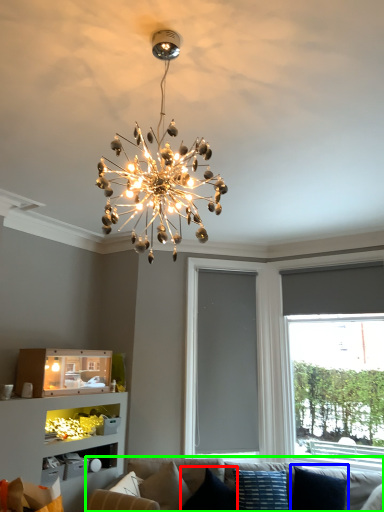
Question: Estimate the real-world distances between objects in this image. Which object is closer to pillow (highlighted by a red box), pillow (highlighted by a blue box) or studio couch (highlighted by a green box)?

Choices:
 (A) pillow
 (B) studio couch

Answer: (B)